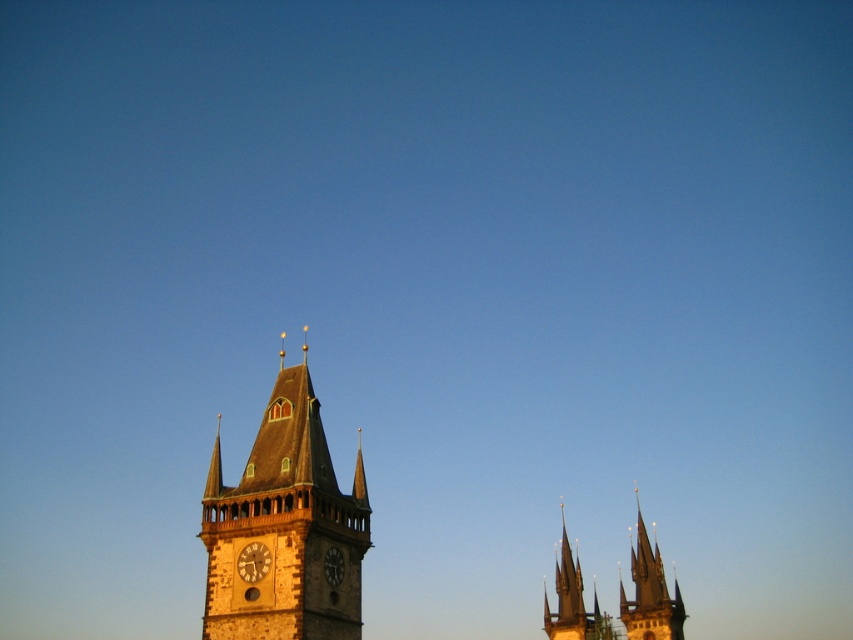
Question: Where is stone clock tower at center located in relation to matte stone clock at center in the image?

Choices:
 (A) below
 (B) above

Answer: (B)

Question: Does stone clock tower at center have a lesser width compared to dark brown stone clock at center?

Choices:
 (A) no
 (B) yes

Answer: (A)

Question: Which point is closer to the camera?

Choices:
 (A) (262, 570)
 (B) (630, 611)
 (C) (204, 632)

Answer: (A)

Question: Which point appears closest to the camera in this image?

Choices:
 (A) (637, 560)
 (B) (263, 568)
 (C) (323, 572)
 (D) (288, 426)

Answer: (B)

Question: Which point is farther to the camera?

Choices:
 (A) (242, 566)
 (B) (337, 568)

Answer: (B)

Question: Is stone spires at center thinner than matte stone clock at center?

Choices:
 (A) yes
 (B) no

Answer: (B)